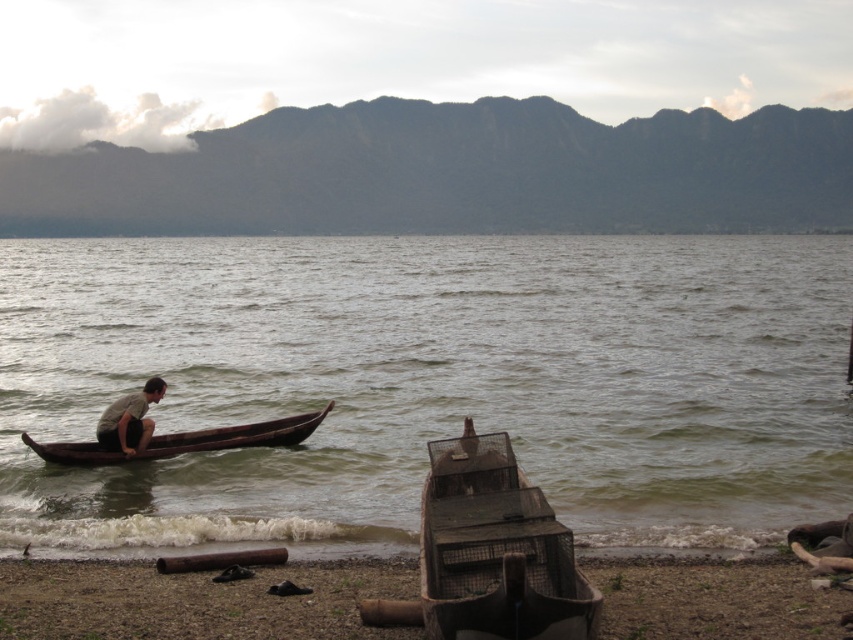
Looking at this image, can you confirm if rusty metal boat at lower center is wider than dark brown wooden canoe at left?

Indeed, rusty metal boat at lower center has a greater width compared to dark brown wooden canoe at left.

In the scene shown: Who is more forward, (834, 628) or (310, 412)?

Point (834, 628) is in front.

At what (x,y) coordinates should I click in order to perform the action: click on rusty metal boat at lower center. Please return your answer as a coordinate pair (x, y). Image resolution: width=853 pixels, height=640 pixels. Looking at the image, I should click on (196, 600).

Can you confirm if brown wooden water at center is taller than dark brown wooden canoe at left?

Correct, brown wooden water at center is much taller as dark brown wooden canoe at left.

Does brown wooden water at center lie behind dark brown wooden canoe at left?

No, it is not.

Find the location of a particular element. This screenshot has width=853, height=640. brown wooden water at center is located at coordinates (430, 381).

From the picture: Does rusty metal boat at lower right have a larger size compared to dark brown wooden canoe at left?

No, rusty metal boat at lower right is not bigger than dark brown wooden canoe at left.

Is point (451, 449) farther from viewer compared to point (271, 438)?

No, (451, 449) is closer to viewer.

Does point (428, 618) come closer to viewer compared to point (169, 444)?

Yes, point (428, 618) is closer to viewer.

Locate an element on the screen. This screenshot has width=853, height=640. rusty metal boat at lower right is located at coordinates (495, 550).